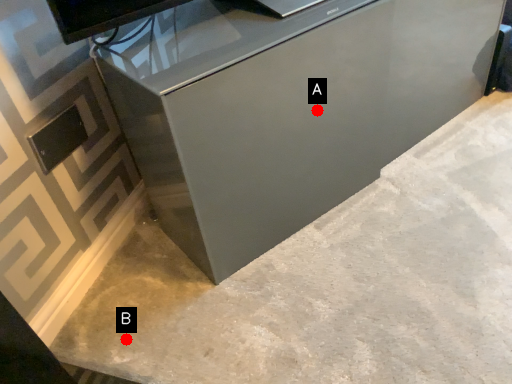
Question: Two points are circled on the image, labeled by A and B beside each circle. Which point appears closest to the camera in this image?

Choices:
 (A) A is closer
 (B) B is closer

Answer: (A)